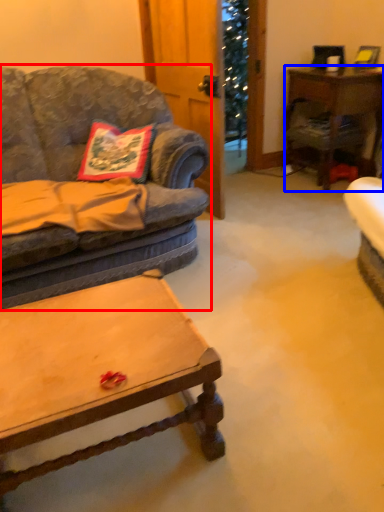
Question: Which point is closer to the camera, studio couch (highlighted by a red box) or desk (highlighted by a blue box)?

Choices:
 (A) studio couch
 (B) desk

Answer: (A)